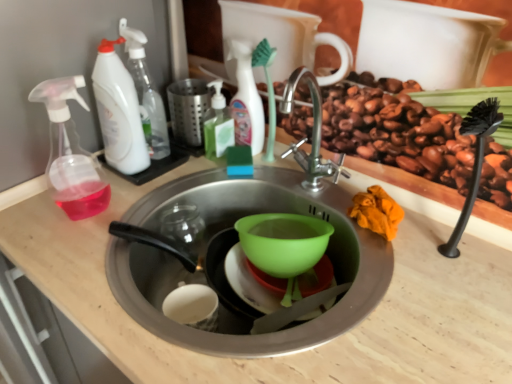
Locate an element on the screen. free spot in front of white matte bottle at upper center, the first cleaning product from the right is located at coordinates (244, 180).